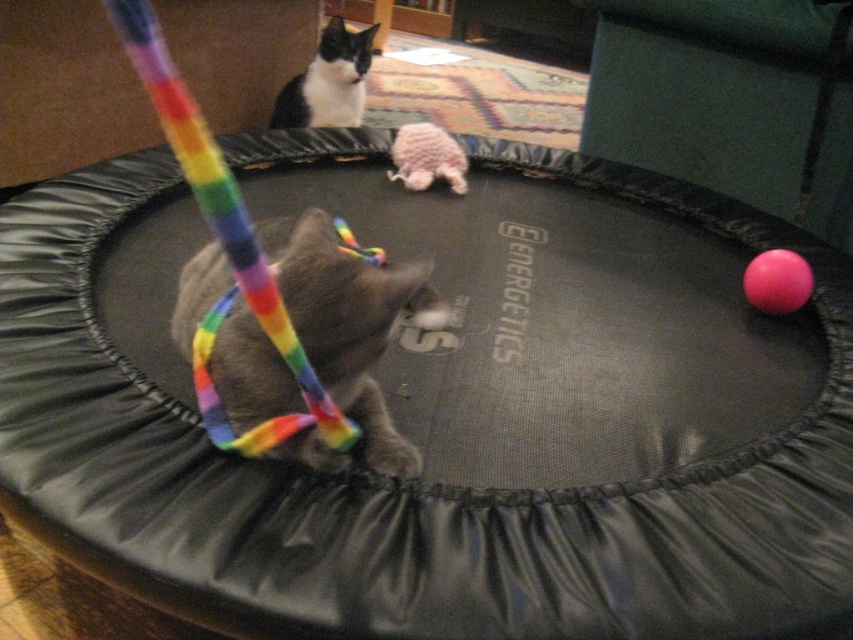
Question: Which point is closer to the camera?

Choices:
 (A) brown fur cat at center
 (B) black and white fur cat at upper center
 (C) pink rubber ball at right

Answer: (A)

Question: Can you confirm if rainbow fabric toy at center is positioned to the left of pink rubber ball at right?

Choices:
 (A) yes
 (B) no

Answer: (A)

Question: Observing the image, what is the correct spatial positioning of rainbow fabric toy at center in reference to black and white fur cat at upper center?

Choices:
 (A) above
 (B) below

Answer: (B)

Question: Is matte green cushion at upper right above fuzzy pink toy at center?

Choices:
 (A) yes
 (B) no

Answer: (A)

Question: Based on their relative distances, which object is nearer to the matte green cushion at upper right?

Choices:
 (A) pink rubber ball at right
 (B) black and white fur cat at upper center
 (C) brown fur cat at center

Answer: (A)

Question: Estimate the real-world distances between objects in this image. Which object is farther from the pink rubber ball at right?

Choices:
 (A) matte green cushion at upper right
 (B) fuzzy pink toy at center

Answer: (A)